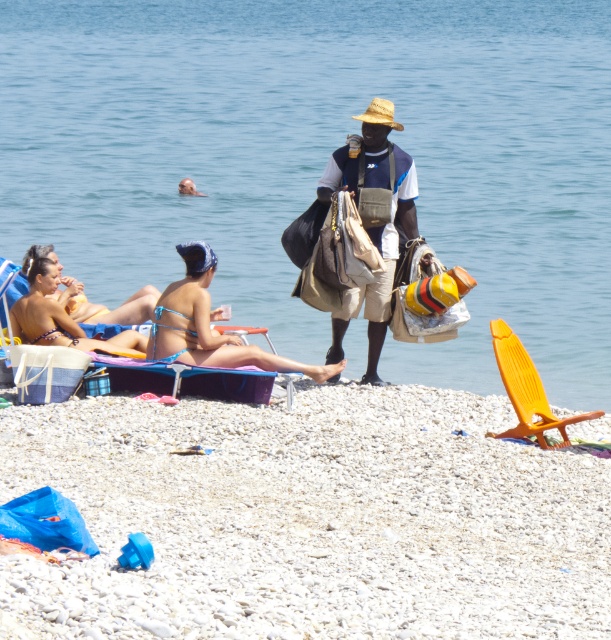
Can you confirm if blue woven beach chair at upper left is taller than blue fabric beach chair at lower left?

In fact, blue woven beach chair at upper left may be shorter than blue fabric beach chair at lower left.

What do you see at coordinates (45, 344) in the screenshot? I see `blue woven beach chair at upper left` at bounding box center [45, 344].

Between point (56, 314) and point (177, 362), which one is positioned in front?

Point (177, 362) is more forward.

Where is `blue woven beach chair at upper left`? The width and height of the screenshot is (611, 640). blue woven beach chair at upper left is located at coordinates (45, 344).

Looking at this image, is white gravel at center wider than orange plastic beach chair at lower right?

Correct, the width of white gravel at center exceeds that of orange plastic beach chair at lower right.

Can you confirm if white gravel at center is bigger than orange plastic beach chair at lower right?

Indeed, white gravel at center has a larger size compared to orange plastic beach chair at lower right.

Where is `white gravel at center`? The width and height of the screenshot is (611, 640). white gravel at center is located at coordinates (310, 518).

Between matte straw hat at center and blue fabric beach chair at lower left, which one has less height?

With less height is blue fabric beach chair at lower left.

The height and width of the screenshot is (640, 611). In order to click on matte straw hat at center in this screenshot , I will do `click(371, 220)`.

This screenshot has height=640, width=611. Find the location of `matte straw hat at center`. matte straw hat at center is located at coordinates (371, 220).